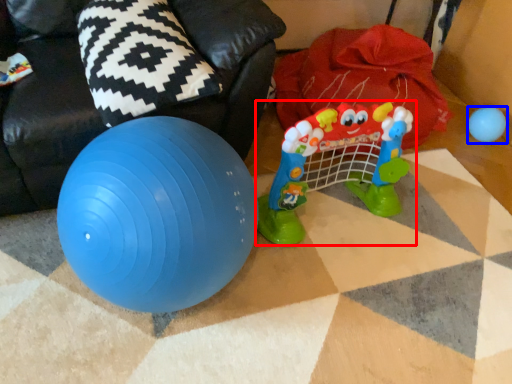
Question: Which point is closer to the camera, toy (highlighted by a red box) or toy (highlighted by a blue box)?

Choices:
 (A) toy
 (B) toy

Answer: (A)